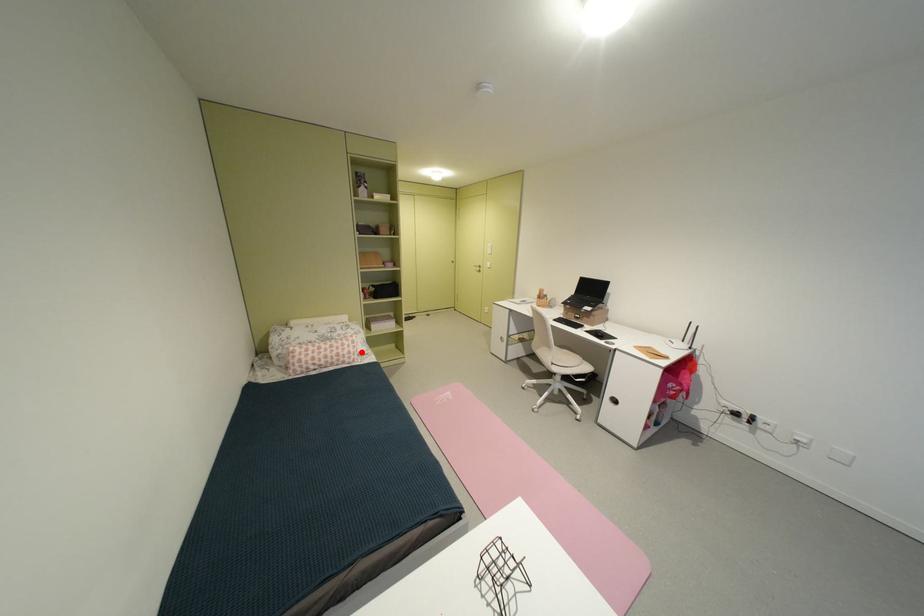
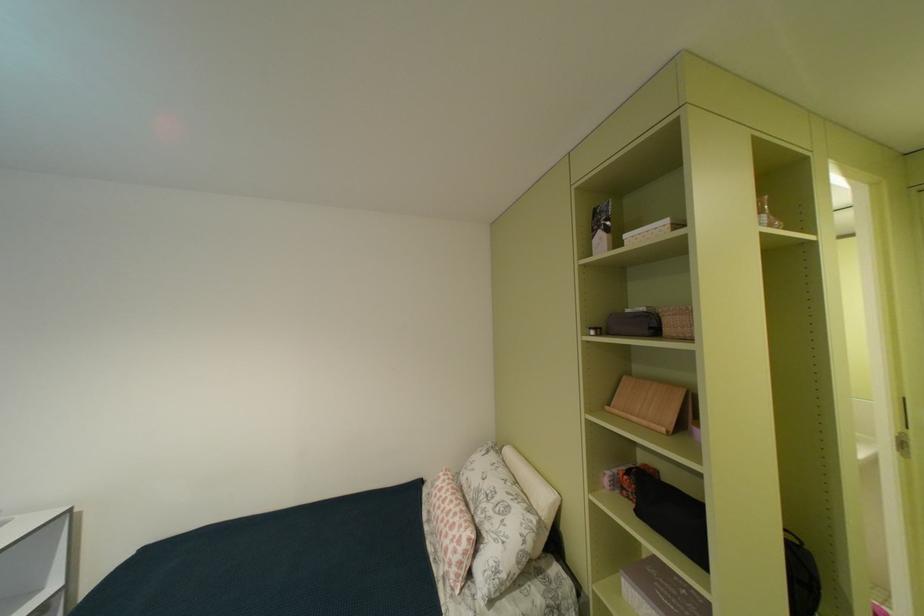
Question: I am providing you with two images of the same scene from different viewpoints. A red point is shown in image1. For the corresponding object point in image2, is it positioned nearer or farther from the camera?

Choices:
 (A) Nearer
 (B) Farther

Answer: (B)